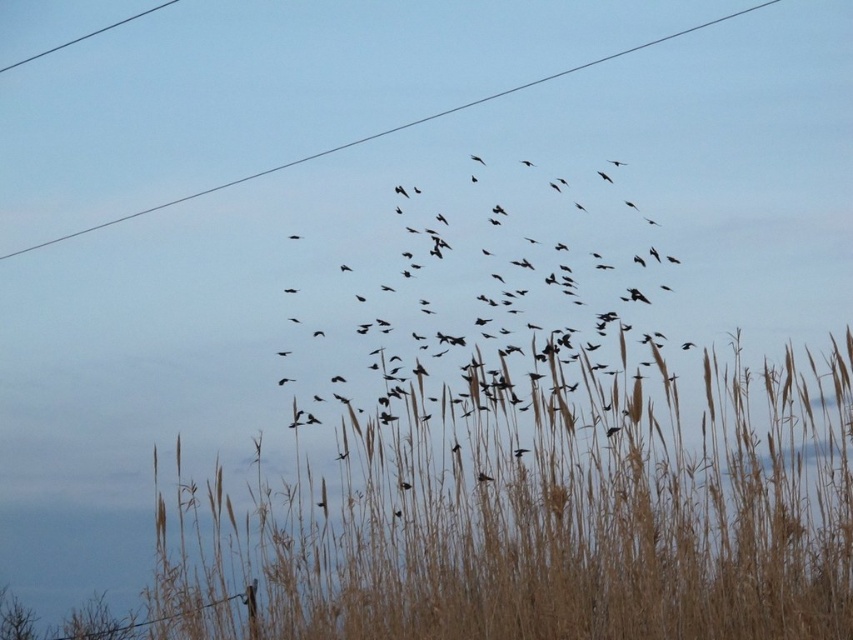
Looking at this image, you are a photographer aiming to capture the birds in flight against the sky. You notice the brown dry grass at lower center and the black wire at upper center in your viewfinder. Which object should you avoid placing in the center of your photo to maintain focus on the birds?

You should avoid placing the black wire at upper center in the center of your photo because it is above the brown dry grass at lower center and closer to the birds, which might distract from the focus on the birds in flight.

You are a bird enthusiast observing the scene. You notice the black matte birds at center and the black wire at upper center. How far apart are these two elements in the image?

The black matte birds at center and the black wire at upper center are 2.15 meters apart from each other.

You are a birdwatcher observing the scene. You notice the black matte birds at center and the black wire at upper center. Which object is positioned to the right side of the other?

The black matte birds at center is to the right of the black wire at upper center.